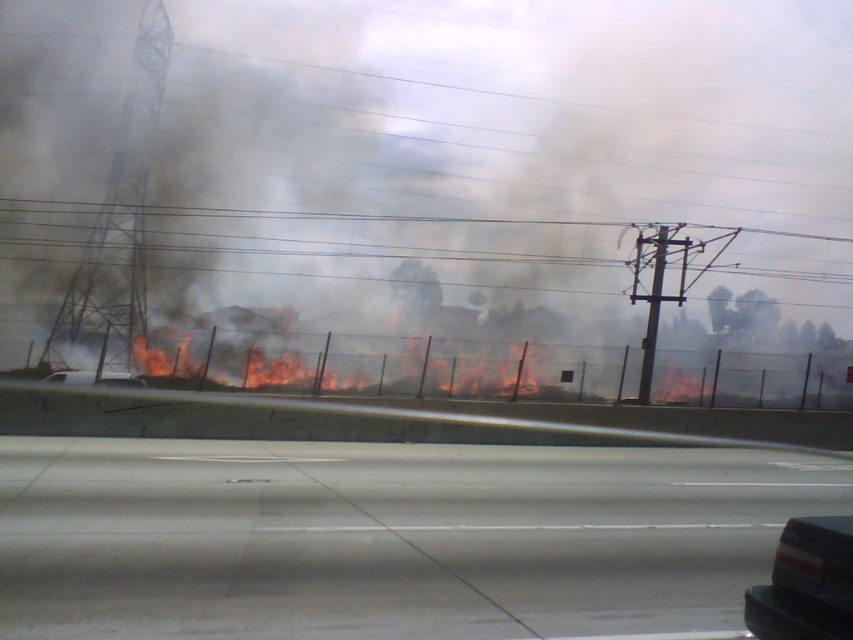
From the picture: Between black smoke at center and black glossy car at lower right, which one has more height?

With more height is black smoke at center.

Is point (746, 84) positioned in front of point (750, 630)?

No, (746, 84) is further to viewer.

The height and width of the screenshot is (640, 853). What are the coordinates of `black smoke at center` in the screenshot? It's located at (393, 163).

Identify the location of black smoke at center. (393, 163).

Between black smoke at center and black matte car at lower center, which one has more height?

black smoke at center

This screenshot has width=853, height=640. In order to click on black smoke at center in this screenshot , I will do 393,163.

From the picture: Can you confirm if black glossy car at lower right is bigger than black matte car at lower center?

Actually, black glossy car at lower right might be smaller than black matte car at lower center.

Is black glossy car at lower right wider than black matte car at lower center?

No.

Identify the location of black glossy car at lower right. (805, 582).

You are a GUI agent. You are given a task and a screenshot of the screen. Output one action in this format:
    pyautogui.click(x=<x>, y=<y>)
    Task: Click on the black glossy car at lower right
    The height and width of the screenshot is (640, 853).
    Given the screenshot: What is the action you would take?
    pyautogui.click(x=805, y=582)